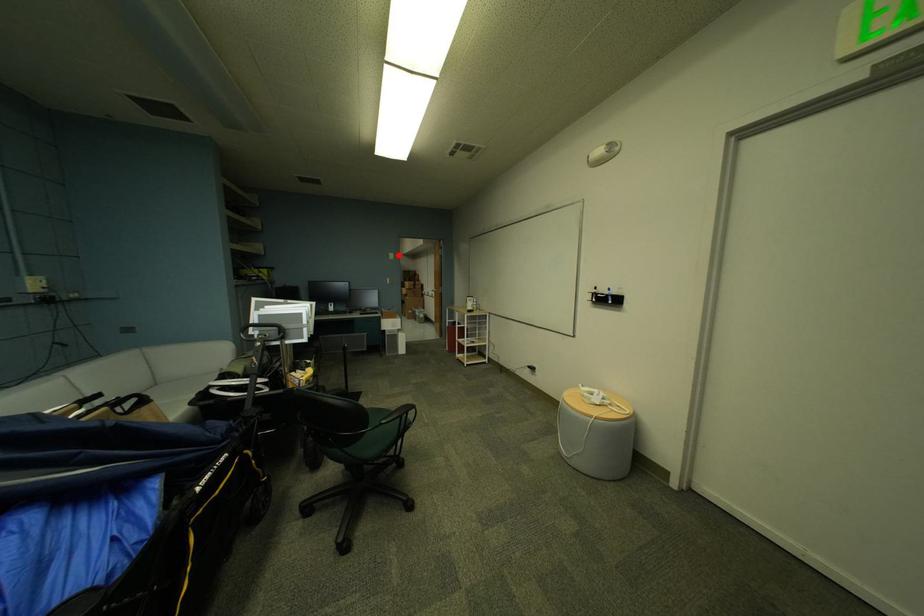
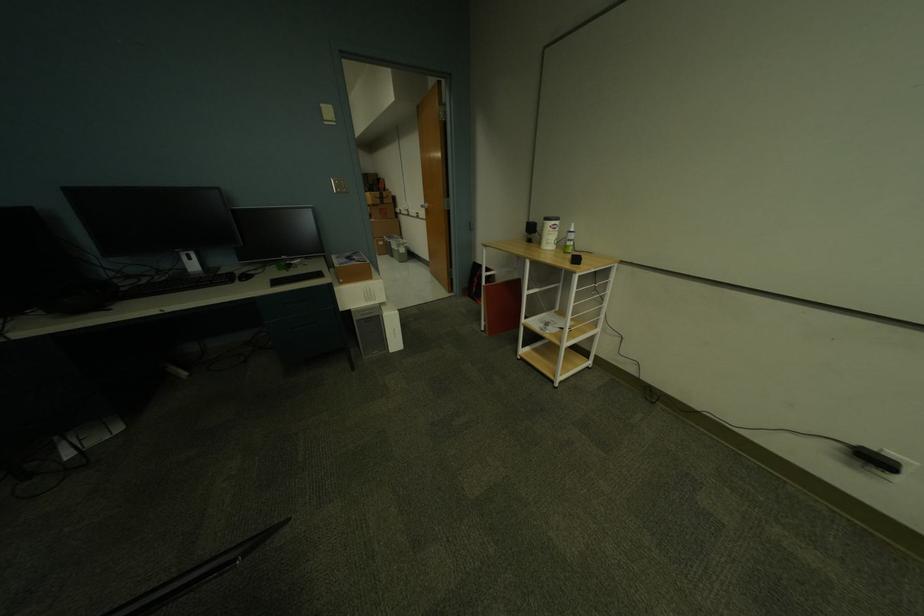
In the second image, find the point that corresponds to the highlighted location in the first image.

(331, 107)